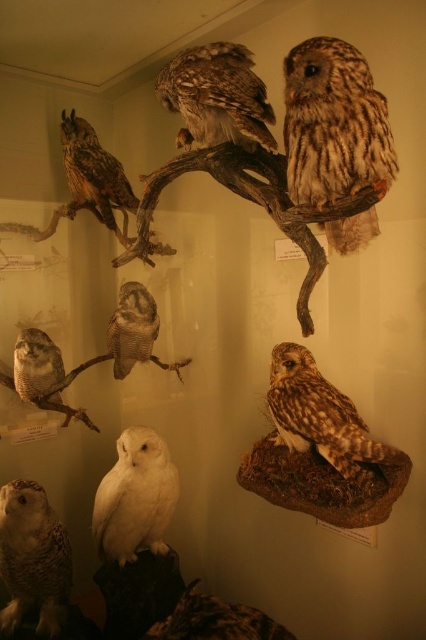
Question: Does brown speckled feathers at upper center lie in front of speckled white owl at lower left?

Choices:
 (A) no
 (B) yes

Answer: (B)

Question: Which object appears farthest from the camera in this image?

Choices:
 (A) white feathered owl at lower left
 (B) brown speckled owl at upper right
 (C) brown speckled feathers at upper center
 (D) brown speckled owl at upper left

Answer: (D)

Question: Is brown speckled feathers at upper center wider than speckled white owl at lower left?

Choices:
 (A) yes
 (B) no

Answer: (A)

Question: Is speckled white owl at lower left smaller than brown speckled owl at center?

Choices:
 (A) yes
 (B) no

Answer: (B)

Question: Which of the following is the farthest from the observer?

Choices:
 (A) (x=9, y=520)
 (B) (x=124, y=193)
 (C) (x=356, y=180)

Answer: (B)

Question: Among these points, which one is farthest from the camera?

Choices:
 (A) (103, 180)
 (B) (16, 563)
 (C) (288, 404)

Answer: (A)